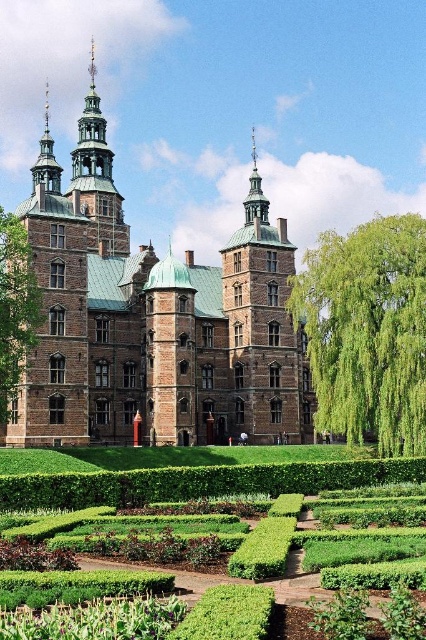
Between brown brick palace at center and green hedge at lower center, which one appears on the left side from the viewer's perspective?

brown brick palace at center

Can you confirm if brown brick palace at center is shorter than green hedge at lower center?

No, brown brick palace at center is not shorter than green hedge at lower center.

Which is behind, point (245, 374) or point (20, 500)?

The point (245, 374) is more distant.

The width and height of the screenshot is (426, 640). I want to click on brown brick palace at center, so click(152, 320).

Is brown brick palace at center in front of green copper tower at upper center?

Yes, brown brick palace at center is closer to the viewer.

Does brown brick palace at center appear on the right side of green copper tower at upper center?

Correct, you'll find brown brick palace at center to the right of green copper tower at upper center.

Who is more forward, (253, 134) or (97, 116)?

Point (97, 116) is more forward.

Where is `brown brick palace at center`? The width and height of the screenshot is (426, 640). brown brick palace at center is located at coordinates (152, 320).

Can you confirm if brown brick palace at center is positioned below green leafy hedge at right?

No, brown brick palace at center is not below green leafy hedge at right.

Does brown brick palace at center have a lesser width compared to green leafy hedge at right?

No, brown brick palace at center is not thinner than green leafy hedge at right.

Who is more distant from viewer, [74,154] or [365,406]?

The point [74,154] is behind.

Locate an element on the screen. The height and width of the screenshot is (640, 426). brown brick palace at center is located at coordinates (152, 320).